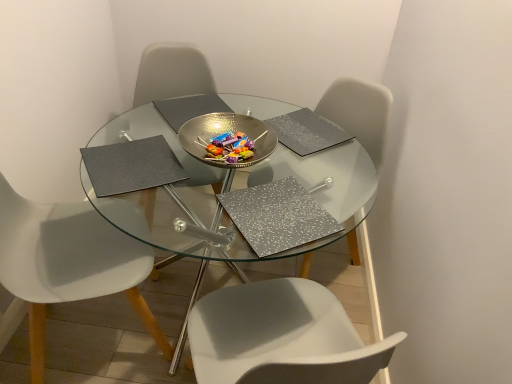
In the scene shown: Measure the distance between white plastic chair at center, which is the second chair from left to right, and camera.

A distance of 1.83 meters exists between white plastic chair at center, which is the second chair from left to right, and camera.

What do you see at coordinates (251, 185) in the screenshot?
I see `transparent glass table at center` at bounding box center [251, 185].

You are a GUI agent. You are given a task and a screenshot of the screen. Output one action in this format:
    pyautogui.click(x=<x>, y=<y>)
    Task: Click on the white plastic chair at left, the first chair positioned from the left
    This screenshot has width=512, height=384.
    Given the screenshot: What is the action you would take?
    pyautogui.click(x=68, y=263)

Locate an element on the screen. This screenshot has height=384, width=512. white plastic chair at center, which is the second chair from right to left is located at coordinates (172, 73).

Measure the distance between gray matte placemat at upper left, which is counted as the third pad, starting from the right, and white plastic chair at center, arranged as the 3th chair when viewed from the left.

They are 33.44 inches apart.

Considering the relative sizes of gray matte placemat at upper left, the first pad when ordered from left to right, and white plastic chair at center, acting as the 1th chair starting from the right, in the image provided, is gray matte placemat at upper left, the first pad when ordered from left to right, taller than white plastic chair at center, acting as the 1th chair starting from the right,?

No.

Between gray matte placemat at upper left, the first pad when ordered from left to right, and white plastic chair at center, acting as the 1th chair starting from the right, which one has larger size?

white plastic chair at center, acting as the 1th chair starting from the right.

How different are the orientations of gray matte placemat at upper left, the first pad when ordered from left to right, and white plastic chair at center, arranged as the 3th chair when viewed from the left, in degrees?

The angle between the facing direction of gray matte placemat at upper left, the first pad when ordered from left to right, and the facing direction of white plastic chair at center, arranged as the 3th chair when viewed from the left, is 14.9 degrees.

From a real-world perspective, who is located lower, white plastic chair at center, which is the second chair from right to left, or silver textured pad at upper center, the third pad from the left?

white plastic chair at center, which is the second chair from right to left, from a real-world perspective.

Would you say white plastic chair at center, which is the second chair from right to left, contains silver textured pad at upper center, the third pad from the left?

No, silver textured pad at upper center, the third pad from the left, is located outside of white plastic chair at center, which is the second chair from right to left.

Does white plastic chair at center, which is the second chair from right to left, have a larger size compared to silver textured pad at upper center, the third pad from the left?

Yes.

In terms of height, does white plastic chair at center, which is the second chair from left to right, look taller or shorter compared to silver textured pad at upper center, the third pad from the left?

Clearly, white plastic chair at center, which is the second chair from left to right, is taller compared to silver textured pad at upper center, the third pad from the left.

From the picture: Does white plastic chair at center, acting as the 1th chair starting from the right, turn towards metallic bowl at center?

Yes, white plastic chair at center, acting as the 1th chair starting from the right, is aimed at metallic bowl at center.

In the scene shown: From a real-world perspective, who is located higher, white plastic chair at center, acting as the 1th chair starting from the right, or metallic bowl at center?

metallic bowl at center.

Which is behind, point (376, 135) or point (246, 119)?

The point (376, 135) is behind.

Based on the photo, between silver textured pad at center, arranged as the 2th pad when viewed from the left, and white plastic chair at center, acting as the 1th chair starting from the right, which one has less height?

Standing shorter between the two is silver textured pad at center, arranged as the 2th pad when viewed from the left.

Is silver textured pad at center, the 2th pad when ordered from right to left, further to the viewer compared to white plastic chair at center, acting as the 1th chair starting from the right?

No, silver textured pad at center, the 2th pad when ordered from right to left, is in front of white plastic chair at center, acting as the 1th chair starting from the right.

Choose the correct answer: Is silver textured pad at center, arranged as the 2th pad when viewed from the left, inside white plastic chair at center, acting as the 1th chair starting from the right, or outside it?

silver textured pad at center, arranged as the 2th pad when viewed from the left, is located beyond the bounds of white plastic chair at center, acting as the 1th chair starting from the right.

Is white plastic chair at center, which is the second chair from left to right, taller than transparent glass table at center?

Correct, white plastic chair at center, which is the second chair from left to right, is much taller as transparent glass table at center.

From a real-world perspective, is white plastic chair at center, which is the second chair from left to right, physically located above or below transparent glass table at center?

In terms of real-world spatial position, white plastic chair at center, which is the second chair from left to right, is above transparent glass table at center.

Between point (199, 57) and point (270, 172), which one is positioned behind?

The point (199, 57) is more distant.

Is white plastic chair at center, which is the second chair from right to left, facing towards transparent glass table at center?

Yes, white plastic chair at center, which is the second chair from right to left, is aimed at transparent glass table at center.

Would you say white plastic chair at left, the first chair positioned from the left, is part of gray matte placemat at upper left, the first pad when ordered from left to right,'s contents?

No, gray matte placemat at upper left, the first pad when ordered from left to right, does not contain white plastic chair at left, the first chair positioned from the left.

From the image's perspective, is gray matte placemat at upper left, the first pad when ordered from left to right, located above white plastic chair at left, the first chair positioned from the left?

Yes.

Does gray matte placemat at upper left, which is counted as the third pad, starting from the right, have a smaller size compared to white plastic chair at left, the first chair positioned from the left?

Indeed, gray matte placemat at upper left, which is counted as the third pad, starting from the right, has a smaller size compared to white plastic chair at left, the first chair positioned from the left.

Measure the distance from gray matte placemat at upper left, which is counted as the third pad, starting from the right, to white plastic chair at left, the first chair positioned from the left.

The distance of gray matte placemat at upper left, which is counted as the third pad, starting from the right, from white plastic chair at left, the first chair positioned from the left, is 12.87 inches.

Locate an element on the screen. This screenshot has width=512, height=384. glass plate on the right of white plastic chair at left, the third chair when ordered from right to left is located at coordinates coord(226,131).

How much distance is there between metallic bowl at center and white plastic chair at left, the first chair positioned from the left?

metallic bowl at center is 20.19 inches away from white plastic chair at left, the first chair positioned from the left.

Considering the positions of point (257, 162) and point (84, 288), is point (257, 162) closer or farther from the camera than point (84, 288)?

Point (257, 162) is farther from the camera than point (84, 288).

How many degrees apart are the facing directions of metallic bowl at center and white plastic chair at left, the first chair positioned from the left?

The facing directions of metallic bowl at center and white plastic chair at left, the first chair positioned from the left, are 109 degrees apart.

This screenshot has width=512, height=384. In order to click on the 3rd pad located above the white plastic chair at center, acting as the 1th chair starting from the right (from a real-world perspective) in this screenshot , I will do `click(132, 166)`.

Starting from the white plastic chair at center, which is the second chair from left to right, which pad is the 1st one in front? Please provide its 2D coordinates.

[(307, 132)]

Considering their positions, is metallic bowl at center positioned further to white plastic chair at left, the third chair when ordered from right to left, than transparent glass table at center?

metallic bowl at center lies further to white plastic chair at left, the third chair when ordered from right to left, than the other object.

When comparing their distances from transparent glass table at center, does silver textured pad at center, the 2th pad when ordered from right to left, or silver textured pad at upper center, the third pad from the left, seem further?

The object further to transparent glass table at center is silver textured pad at upper center, the third pad from the left.

In the scene shown: Looking at the image, which one is located closer to white plastic chair at center, acting as the 1th chair starting from the right, gray matte placemat at upper left, which is counted as the third pad, starting from the right, or white plastic chair at center, which is the second chair from right to left?

Based on the image, white plastic chair at center, which is the second chair from right to left, appears to be nearer to white plastic chair at center, acting as the 1th chair starting from the right.

Based on their spatial positions, is silver textured pad at center, the 2th pad when ordered from right to left, or transparent glass table at center further from white plastic chair at left, the first chair positioned from the left?

silver textured pad at center, the 2th pad when ordered from right to left.

Based on their spatial positions, is white plastic chair at center, acting as the 1th chair starting from the right, or transparent glass table at center further from silver textured pad at center, arranged as the 2th pad when viewed from the left?

Based on the image, white plastic chair at center, acting as the 1th chair starting from the right, appears to be further to silver textured pad at center, arranged as the 2th pad when viewed from the left.

From the image, which object appears to be farther from silver textured pad at upper center, the 1th pad from the right, silver textured pad at center, arranged as the 2th pad when viewed from the left, or transparent glass table at center?

silver textured pad at center, arranged as the 2th pad when viewed from the left.

Consider the image. Estimate the real-world distances between objects in this image. Which object is closer to white plastic chair at center, arranged as the 3th chair when viewed from the left, transparent glass table at center or silver textured pad at center, arranged as the 2th pad when viewed from the left?

transparent glass table at center.

Considering their positions, is silver textured pad at center, the 2th pad when ordered from right to left, positioned further to gray matte placemat at upper left, which is counted as the third pad, starting from the right, than metallic bowl at center?

silver textured pad at center, the 2th pad when ordered from right to left.

Find the location of `chair between gray matte placemat at upper left, which is counted as the third pad, starting from the right, and silver textured pad at upper center, the third pad from the left, from left to right`. chair between gray matte placemat at upper left, which is counted as the third pad, starting from the right, and silver textured pad at upper center, the third pad from the left, from left to right is located at coordinates (172, 73).

Locate an element on the screen. Image resolution: width=512 pixels, height=384 pixels. table situated between white plastic chair at left, the first chair positioned from the left, and silver textured pad at center, arranged as the 2th pad when viewed from the left, from left to right is located at coordinates (251, 185).

The image size is (512, 384). Identify the location of pad located between white plastic chair at left, the third chair when ordered from right to left, and metallic bowl at center in the left-right direction. (132, 166).

You are a GUI agent. You are given a task and a screenshot of the screen. Output one action in this format:
    pyautogui.click(x=<x>, y=<y>)
    Task: Click on the glass plate between white plastic chair at left, the third chair when ordered from right to left, and silver textured pad at center, arranged as the 2th pad when viewed from the left, from left to right
    
    Given the screenshot: What is the action you would take?
    pyautogui.click(x=226, y=131)